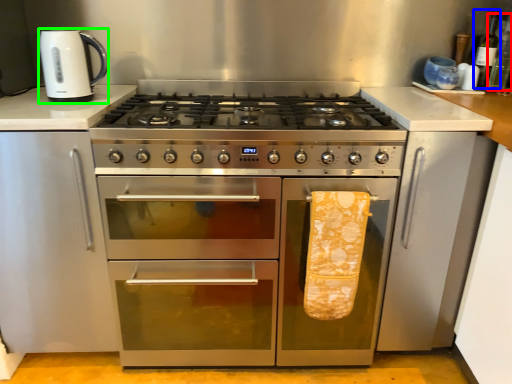
Question: Which object is the farthest from bottle (highlighted by a red box)? Choose among these: bottle (highlighted by a blue box) or kitchen appliance (highlighted by a green box).

Choices:
 (A) bottle
 (B) kitchen appliance

Answer: (B)